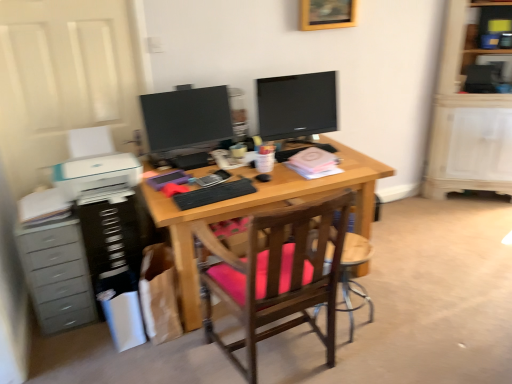
Where is `vacant area that lies between wooden chair with pink cushion at center and wooden chair at center`? This screenshot has width=512, height=384. vacant area that lies between wooden chair with pink cushion at center and wooden chair at center is located at coordinates (357, 356).